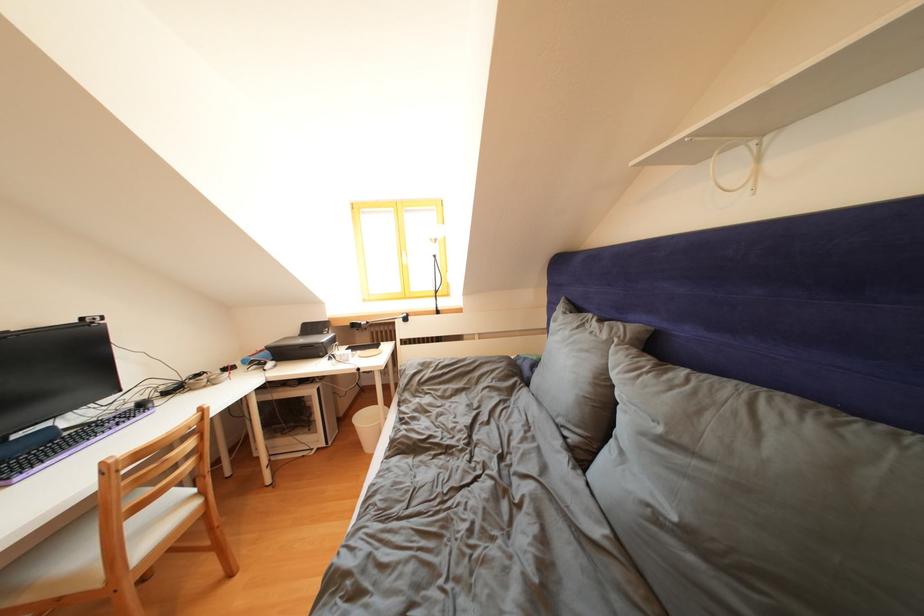
You are a GUI agent. You are given a task and a screenshot of the screen. Output one action in this format:
    pyautogui.click(x=<x>, y=<y>)
    Task: Click on the printer lid
    The height and width of the screenshot is (616, 924).
    Given the screenshot: What is the action you would take?
    pyautogui.click(x=312, y=328)